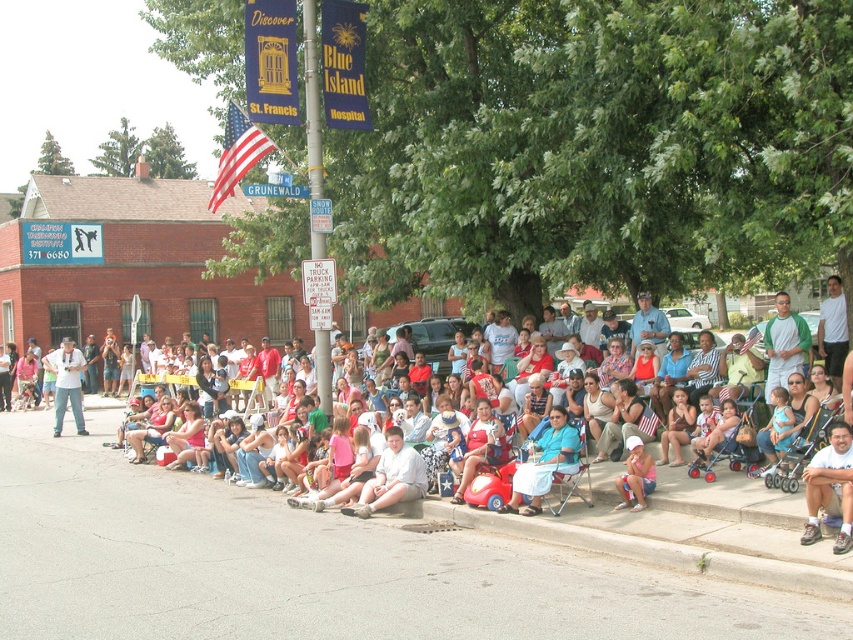
Can you confirm if white cotton dress at center is thinner than light brown shorts at center?

Indeed, white cotton dress at center has a lesser width compared to light brown shorts at center.

Who is more forward, (x=514, y=506) or (x=372, y=483)?

Positioned in front is point (x=514, y=506).

Between point (558, 419) and point (370, 480), which one is positioned behind?

The point (370, 480) is behind.

Find the location of a particular element. The width and height of the screenshot is (853, 640). white cotton dress at center is located at coordinates (544, 464).

Is light brown shorts at center thinner than matte white camera at left?

No, light brown shorts at center is not thinner than matte white camera at left.

Describe the element at coordinates (392, 477) in the screenshot. I see `light brown shorts at center` at that location.

Does point (363, 506) come farther from viewer compared to point (73, 404)?

No, it is in front of (73, 404).

Locate an element on the screen. Image resolution: width=853 pixels, height=640 pixels. light brown shorts at center is located at coordinates (392, 477).

From the picture: Is matte red car at center taller than pink fabric dress at lower center?

Yes.

At what (x,y) coordinates should I click in order to perform the action: click on matte red car at center. Please return your answer as a coordinate pair (x, y). Looking at the image, I should click on (480, 445).

This screenshot has height=640, width=853. I want to click on matte red car at center, so click(x=480, y=445).

Image resolution: width=853 pixels, height=640 pixels. Identify the location of matte red car at center. (480, 445).